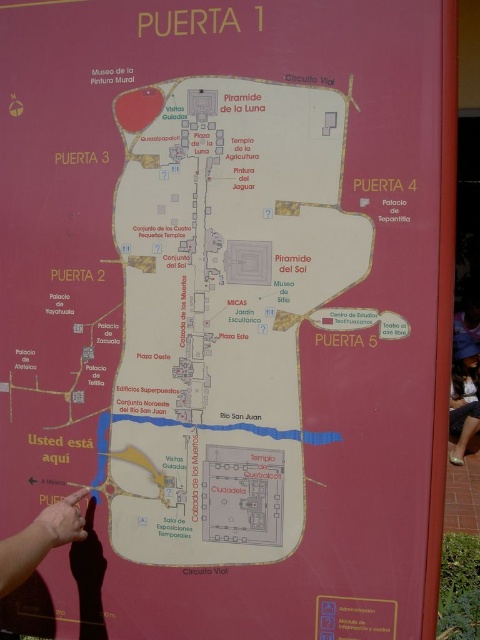
You are standing in front of the white paper map at center and the matte black dress at lower right. Which object is positioned to the right when viewed from your perspective?

The matte black dress at lower right is positioned to the right of the white paper map at center.

You are at an archaeological site and need to locate the white paper map at center and the matte black dress at lower right. According to the map, which object is taller?

The white paper map at center is shorter than the matte black dress at lower right, so the matte black dress at lower right is taller.